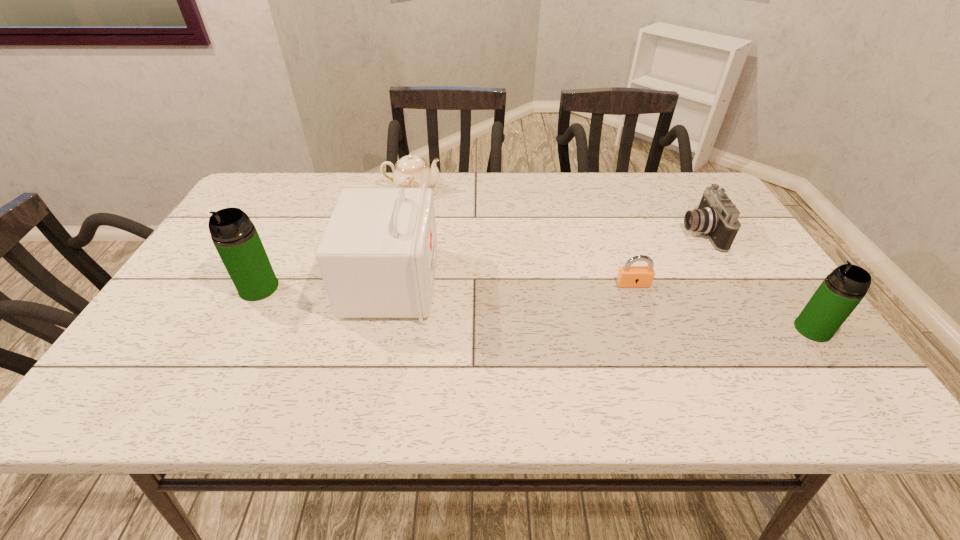
To achieve uniform spacing by inserting another thermos_bottle among them, please point to a free space for this new thermos_bottle. Please provide its 2D coordinates. Your answer should be formatted as a tuple, i.e. [(x, y)], where the tuple contains the x and y coordinates of a point satisfying the conditions above.

[(523, 308)]